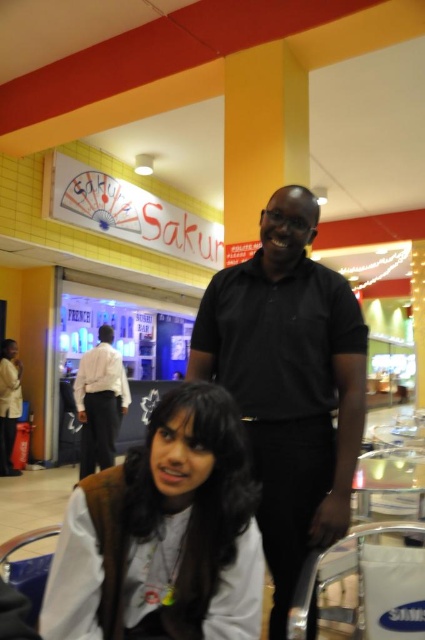
Between point (302, 304) and point (81, 465), which one is positioned behind?

Positioned behind is point (81, 465).

From the picture: Is black matte shirt at center in front of white shirt at center?

Yes, it is.

Does point (274, 321) lie in front of point (107, 410)?

Yes, point (274, 321) is closer to viewer.

I want to click on black matte shirt at center, so click(289, 384).

Is point (232, 589) closer to viewer compared to point (110, 390)?

Yes, point (232, 589) is in front of point (110, 390).

Looking at this image, who is taller, white matte vest at lower center or white shirt at center?

With more height is white shirt at center.

Is point (170, 481) positioned before point (87, 464)?

Yes.

Where is `white matte vest at lower center`? The height and width of the screenshot is (640, 425). white matte vest at lower center is located at coordinates (164, 532).

Looking at this image, does white shirt at center have a smaller size compared to white shirt at lower left?

No.

Is the position of white shirt at center more distant than that of white shirt at lower left?

No, white shirt at center is closer to the viewer.

Locate an element on the screen. This screenshot has height=640, width=425. white shirt at center is located at coordinates (99, 401).